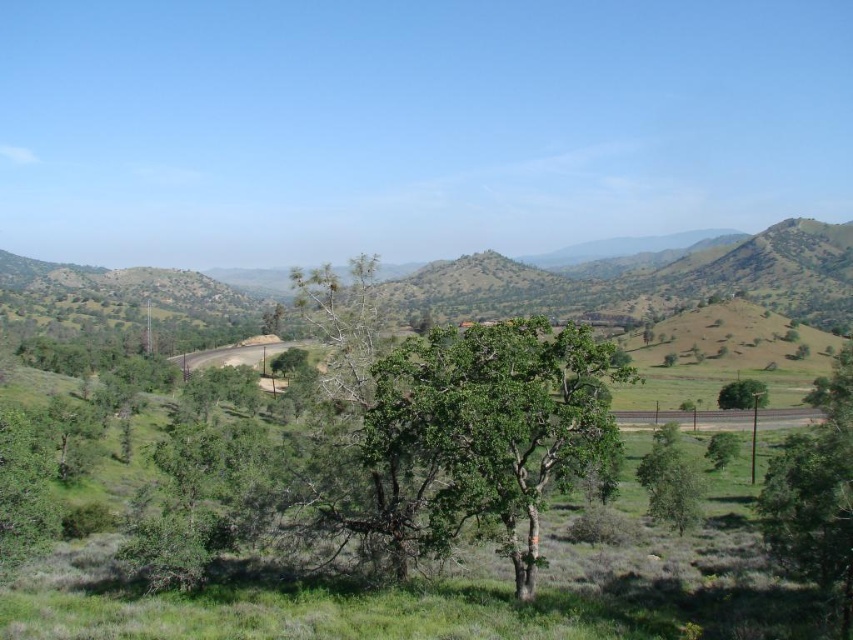
Question: Is green leafy tree at center below green leafy tree at right?

Choices:
 (A) yes
 (B) no

Answer: (B)

Question: Does green leafy tree at center appear over green leafy tree at lower left?

Choices:
 (A) no
 (B) yes

Answer: (B)

Question: Among these objects, which one is farthest from the camera?

Choices:
 (A) green leafy tree at lower left
 (B) green leafy tree at right
 (C) green leafy tree at center

Answer: (B)

Question: Which of these objects is positioned farthest from the green leafy tree at lower left?

Choices:
 (A) green leafy tree at right
 (B) green leafy tree at center

Answer: (A)

Question: Is green leafy tree at center behind green leafy tree at right?

Choices:
 (A) yes
 (B) no

Answer: (B)

Question: Which of these objects is positioned farthest from the green leafy tree at lower left?

Choices:
 (A) green leafy tree at center
 (B) green leafy tree at right

Answer: (B)